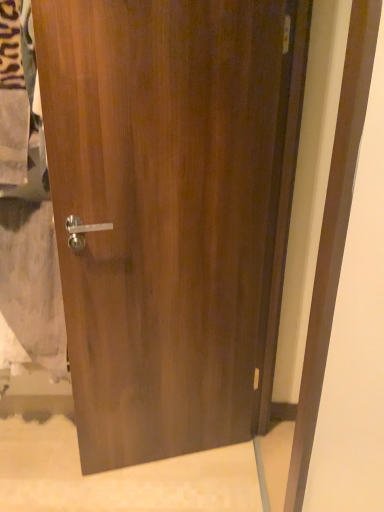
Find the location of `matte wood door at center`. matte wood door at center is located at coordinates (171, 211).

Describe the element at coordinates (171, 211) in the screenshot. I see `matte wood door at center` at that location.

Measure the distance between matte wood door at center and camera.

The distance of matte wood door at center from camera is 1.04 meters.

The height and width of the screenshot is (512, 384). Identify the location of matte wood door at center. (171, 211).